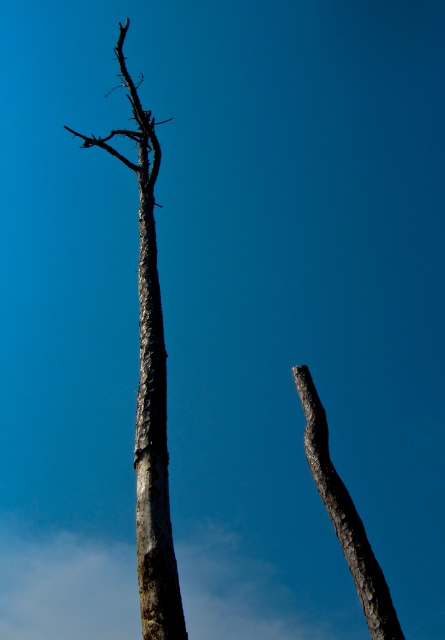
Question: Can you confirm if gray textured trunk at center is bigger than gray rough bark branch at center?

Choices:
 (A) yes
 (B) no

Answer: (A)

Question: Does smooth bark tree trunk at center lie behind dark gray bark branch at upper right?

Choices:
 (A) no
 (B) yes

Answer: (B)

Question: Can you confirm if gray textured trunk at center is wider than dark gray bark branch at upper right?

Choices:
 (A) yes
 (B) no

Answer: (A)

Question: Among these points, which one is farthest from the camera?

Choices:
 (A) pos(377,625)
 (B) pos(161,602)
 (C) pos(149,428)
 (D) pos(148,196)

Answer: (D)

Question: Which point is farther to the camera?

Choices:
 (A) smooth bark tree trunk at center
 (B) gray rough bark branch at center
 (C) gray textured trunk at center
 (D) dark gray bark branch at upper right

Answer: (B)

Question: Which point is closer to the camera taking this photo?

Choices:
 (A) (148, 483)
 (B) (331, 493)
 (C) (108, 138)

Answer: (B)